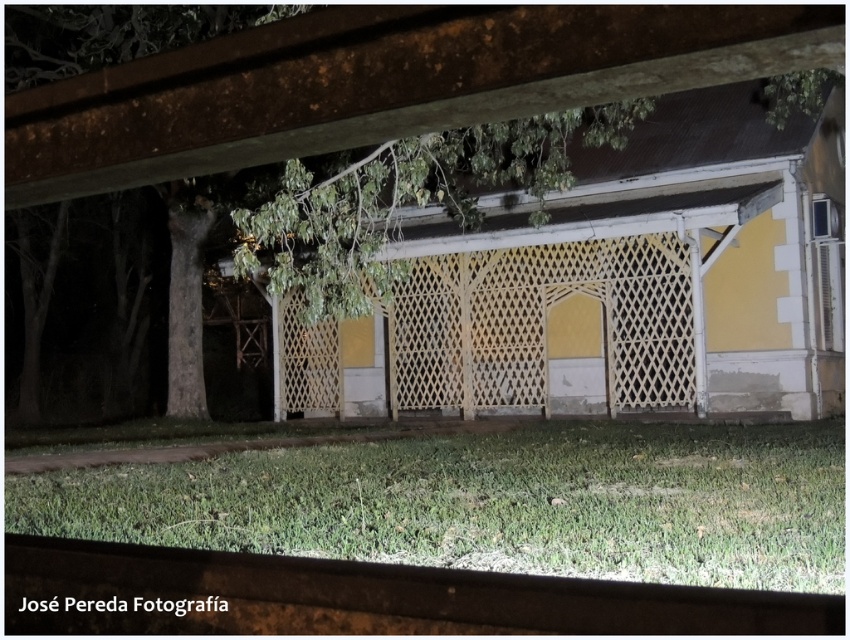
You are standing in front of the building and notice both the yellow lattice fence at center and the green leafy tree at center. Which object is larger in size?

The green leafy tree at center is larger than the yellow lattice fence at center.

You are standing in front of the building with the yellow walls and white lattice fencing. You notice the green grass at lower center and the green leafy tree at center. Which of these two has a larger width?

The green leafy tree at center has a larger width than the green grass at lower center.

You are standing in the nighttime scene and want to walk from the green leafy tree at center to the yellow lattice fence at center. Which direction should you face to walk directly towards the fence?

You should face to the right to walk directly towards the yellow lattice fence at center, since the yellow lattice fence at center is located to the right of the green leafy tree at center.